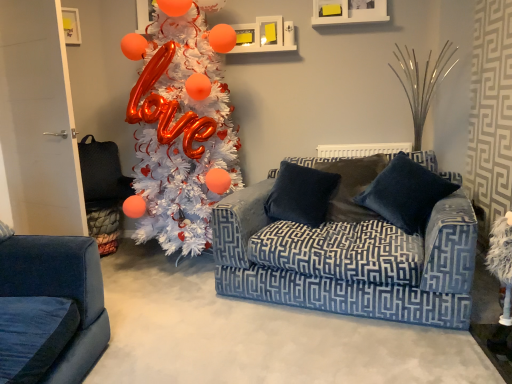
Question: In which direction should I rotate to look at velvet dark blue pillow at center, placed as the 2th pillow when sorted from left to right?

Choices:
 (A) left
 (B) right

Answer: (B)

Question: Is white matte christmas tree at left facing away from velvet dark blue pillow at center, which is the first pillow from right to left?

Choices:
 (A) no
 (B) yes

Answer: (A)

Question: Can you confirm if white matte christmas tree at left is taller than velvet dark blue pillow at center, placed as the 2th pillow when sorted from left to right?

Choices:
 (A) no
 (B) yes

Answer: (B)

Question: Can velvet dark blue pillow at center, placed as the 2th pillow when sorted from left to right, be found inside white matte christmas tree at left?

Choices:
 (A) yes
 (B) no

Answer: (B)

Question: Considering the relative sizes of white matte christmas tree at left and velvet dark blue pillow at center, placed as the 2th pillow when sorted from left to right, in the image provided, is white matte christmas tree at left smaller than velvet dark blue pillow at center, placed as the 2th pillow when sorted from left to right,?

Choices:
 (A) no
 (B) yes

Answer: (A)

Question: From the image's perspective, is white matte christmas tree at left located above velvet dark blue pillow at center, placed as the 2th pillow when sorted from left to right?

Choices:
 (A) no
 (B) yes

Answer: (B)

Question: From a real-world perspective, does white matte christmas tree at left stand above velvet dark blue pillow at center, placed as the 2th pillow when sorted from left to right?

Choices:
 (A) yes
 (B) no

Answer: (A)

Question: Considering the relative sizes of velvet dark blue pillow at center, placed as the 2th pillow when sorted from left to right, and velvet dark blue pillow at center, acting as the 2th pillow starting from the right, in the image provided, is velvet dark blue pillow at center, placed as the 2th pillow when sorted from left to right, wider than velvet dark blue pillow at center, acting as the 2th pillow starting from the right,?

Choices:
 (A) no
 (B) yes

Answer: (B)

Question: Can you confirm if velvet dark blue pillow at center, which is the first pillow from right to left, is positioned to the left of velvet dark blue pillow at center, the 1th pillow in the left-to-right sequence?

Choices:
 (A) no
 (B) yes

Answer: (A)

Question: Is velvet dark blue pillow at center, placed as the 2th pillow when sorted from left to right, directly adjacent to velvet dark blue pillow at center, the 1th pillow in the left-to-right sequence?

Choices:
 (A) yes
 (B) no

Answer: (B)

Question: Is velvet dark blue pillow at center, placed as the 2th pillow when sorted from left to right, not inside velvet dark blue pillow at center, acting as the 2th pillow starting from the right?

Choices:
 (A) no
 (B) yes

Answer: (B)

Question: From the image's perspective, is velvet dark blue pillow at center, which is the first pillow from right to left, on top of velvet dark blue pillow at center, acting as the 2th pillow starting from the right?

Choices:
 (A) yes
 (B) no

Answer: (A)

Question: Is velvet dark blue pillow at center, placed as the 2th pillow when sorted from left to right, positioned before velvet dark blue pillow at center, the 1th pillow in the left-to-right sequence?

Choices:
 (A) no
 (B) yes

Answer: (B)

Question: Does velvet dark blue pillow at center, the 1th pillow in the left-to-right sequence, have a lesser width compared to velvet dark blue pillow at center, placed as the 2th pillow when sorted from left to right?

Choices:
 (A) yes
 (B) no

Answer: (A)